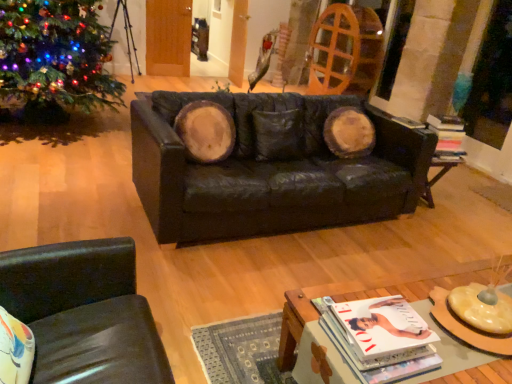
Measure the distance between point [316,312] and camera.

Point [316,312] and camera are 5.12 feet apart.

This screenshot has width=512, height=384. What do you see at coordinates (84, 313) in the screenshot?
I see `black leather chair at lower left` at bounding box center [84, 313].

The image size is (512, 384). I want to click on black leather side table at lower right, so click(440, 171).

From the image's perspective, would you say black leather couch at center is positioned over matte white magazine at lower center, the second magazine positioned from the right?

Correct, black leather couch at center appears higher than matte white magazine at lower center, the second magazine positioned from the right, in the image.

Considering the relative sizes of black leather couch at center and matte white magazine at lower center, placed as the 1th magazine when sorted from left to right, in the image provided, is black leather couch at center thinner than matte white magazine at lower center, placed as the 1th magazine when sorted from left to right,?

Incorrect, the width of black leather couch at center is not less than that of matte white magazine at lower center, placed as the 1th magazine when sorted from left to right.

From a real-world perspective, is black leather couch at center located beneath matte white magazine at lower center, arranged as the first magazine when ordered from the bottom?

Yes, from a real-world perspective, black leather couch at center is under matte white magazine at lower center, arranged as the first magazine when ordered from the bottom.

Which is more to the right, black leather chair at lower left or green matte christmas tree at left?

Positioned to the right is black leather chair at lower left.

Is black leather chair at lower left not near green matte christmas tree at left?

Yes, black leather chair at lower left and green matte christmas tree at left are quite far apart.

Which is in front, point (109, 284) or point (6, 34)?

Point (109, 284)

Is point (460, 140) closer or farther from the camera than point (247, 179)?

Point (460, 140).

Which is more to the left, matte black magazine at right, the second magazine when ordered from bottom to top, or black leather couch at center?

From the viewer's perspective, black leather couch at center appears more on the left side.

Between matte black magazine at right, the first magazine positioned from the top, and black leather couch at center, which one has smaller width?

Thinner between the two is matte black magazine at right, the first magazine positioned from the top.

From a real-world perspective, is matte black magazine at right, acting as the 2th magazine starting from the front, physically located above or below black leather couch at center?

Clearly, from a real-world perspective, matte black magazine at right, acting as the 2th magazine starting from the front, is above black leather couch at center.

Are black leather side table at lower right and wooden coffee table at lower center far apart?

Yes.

Which of these two, black leather side table at lower right or wooden coffee table at lower center, is bigger?

With larger size is wooden coffee table at lower center.

Can you tell me how much black leather side table at lower right and wooden coffee table at lower center differ in facing direction?

The angular difference between black leather side table at lower right and wooden coffee table at lower center is 4.05 degrees.

From the image's perspective, is black leather side table at lower right under wooden coffee table at lower center?

Incorrect, from the image's perspective, black leather side table at lower right is higher than wooden coffee table at lower center.

Are black leather couch at center and black leather chair at lower left far apart?

Indeed, black leather couch at center is not near black leather chair at lower left.

Is black leather couch at center wider or thinner than black leather chair at lower left?

black leather couch at center is wider than black leather chair at lower left.

Considering their positions, is black leather couch at center located in front of or behind black leather chair at lower left?

Visually, black leather couch at center is located behind black leather chair at lower left.

Considering the positions of points (407, 357) and (315, 161), is point (407, 357) farther from camera compared to point (315, 161)?

No.

From a real-world perspective, which object stands above the other?

From a 3D spatial view, matte white magazine at lower center, the second magazine viewed from the back, is above.

Could you tell me if matte white magazine at lower center, placed as the 2th magazine when sorted from top to bottom, is facing black leather couch at center?

Yes.

Is matte white magazine at lower center, arranged as the first magazine when ordered from the bottom, taller or shorter than black leather couch at center?

matte white magazine at lower center, arranged as the first magazine when ordered from the bottom, is shorter than black leather couch at center.

Based on their sizes in the image, would you say matte white magazine at lower center, placed as the 2th magazine when sorted from top to bottom, is bigger or smaller than black leather side table at lower right?

Clearly, matte white magazine at lower center, placed as the 2th magazine when sorted from top to bottom, is smaller in size than black leather side table at lower right.

Who is taller, matte white magazine at lower center, the second magazine viewed from the back, or black leather side table at lower right?

Standing taller between the two is black leather side table at lower right.

In the scene shown: Is matte white magazine at lower center, the second magazine positioned from the right, positioned with its back to black leather side table at lower right?

matte white magazine at lower center, the second magazine positioned from the right, is not turned away from black leather side table at lower right.

Which is behind, matte white magazine at lower center, placed as the 2th magazine when sorted from top to bottom, or black leather side table at lower right?

black leather side table at lower right is behind.

Identify the location of the 1st magazine above the black leather couch at center (from a real-world perspective). (380, 338).

At what (x,y) coordinates should I click in order to perform the action: click on chair below the green matte christmas tree at left (from the image's perspective). Please return your answer as a coordinate pair (x, y). This screenshot has height=384, width=512. Looking at the image, I should click on (84, 313).

Estimate the real-world distances between objects in this image. Which object is further from black leather side table at lower right, black leather couch at center or green matte christmas tree at left?

green matte christmas tree at left is positioned further to the anchor black leather side table at lower right.

Estimate the real-world distances between objects in this image. Which object is closer to matte white magazine at lower center, placed as the 1th magazine when sorted from left to right, matte black magazine at right, the second magazine when ordered from bottom to top, or black leather side table at lower right?

black leather side table at lower right.

Considering their positions, is green matte christmas tree at left positioned closer to wooden coffee table at lower center than black leather couch at center?

The object closer to wooden coffee table at lower center is black leather couch at center.

Considering their positions, is black leather couch at center positioned further to wooden coffee table at lower center than black leather side table at lower right?

black leather side table at lower right lies further to wooden coffee table at lower center than the other object.

From the image, which object appears to be nearer to wooden coffee table at lower center, black leather chair at lower left or matte white magazine at lower center, placed as the 1th magazine when sorted from left to right?

matte white magazine at lower center, placed as the 1th magazine when sorted from left to right, is closer to wooden coffee table at lower center.

Estimate the real-world distances between objects in this image. Which object is closer to black leather couch at center, wooden coffee table at lower center or black leather side table at lower right?

black leather side table at lower right.

When comparing their distances from matte black magazine at right, the second magazine when ordered from bottom to top, does black leather couch at center or black leather chair at lower left seem further?

Based on the image, black leather chair at lower left appears to be further to matte black magazine at right, the second magazine when ordered from bottom to top.

From the image, which object appears to be nearer to green matte christmas tree at left, black leather couch at center or black leather side table at lower right?

Based on the image, black leather couch at center appears to be nearer to green matte christmas tree at left.

The image size is (512, 384). I want to click on magazine between green matte christmas tree at left and wooden coffee table at lower center in the horizontal direction, so click(380, 338).

Identify the location of side table between black leather couch at center and matte black magazine at right, acting as the 2th magazine starting from the front, in the horizontal direction. The height and width of the screenshot is (384, 512). (440, 171).

The width and height of the screenshot is (512, 384). I want to click on chair between green matte christmas tree at left and matte white magazine at lower center, arranged as the first magazine when ordered from the bottom, from left to right, so click(84, 313).

You are a GUI agent. You are given a task and a screenshot of the screen. Output one action in this format:
    pyautogui.click(x=<x>, y=<y>)
    Task: Click on the studio couch between green matte christmas tree at left and matte white magazine at lower center, arranged as the first magazine when ordered from the bottom, in the horizontal direction
    
    Given the screenshot: What is the action you would take?
    pyautogui.click(x=272, y=167)